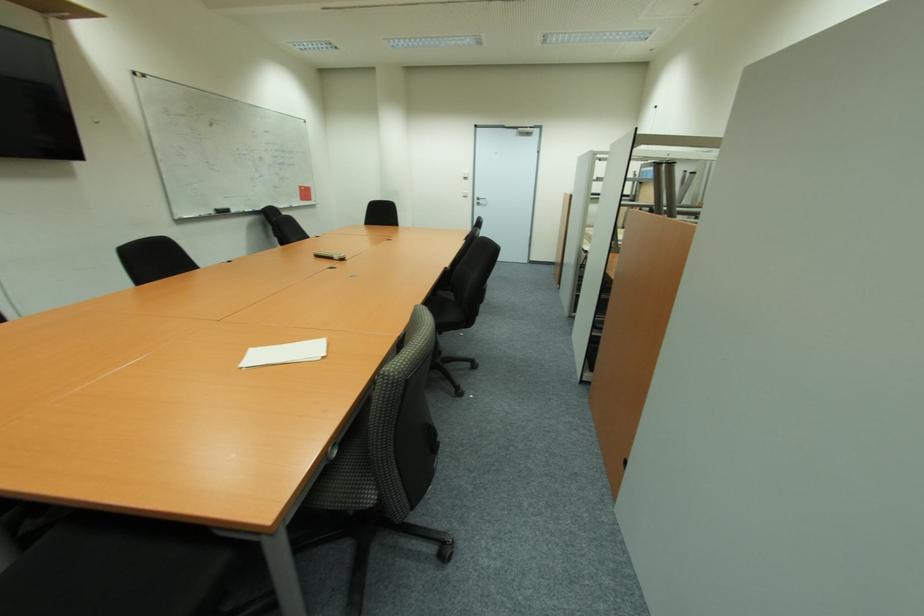
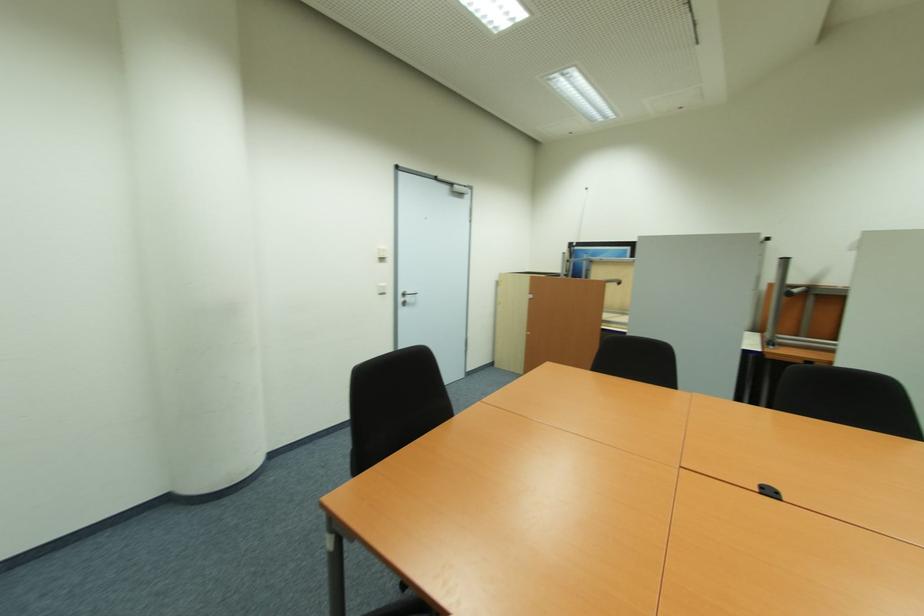
Find the pixel in the second image that matches (x=468, y=198) in the first image.

(383, 294)